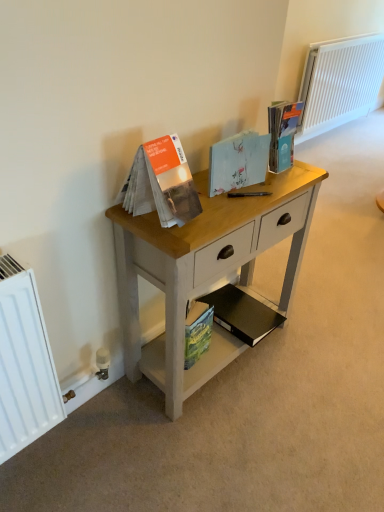
Locate an element on the screen. This screenshot has height=512, width=384. free area in between light wood desk at center and black matte book at lower center, which is the 2th paperback book from bottom to top is located at coordinates (237, 373).